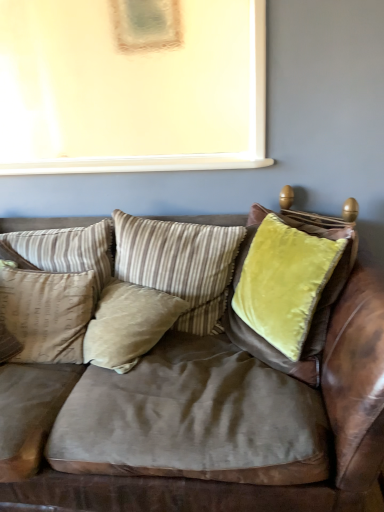
Question: Does beige velvet pillow at center, placed as the second pillow when sorted from right to left, have a greater height compared to beige striped pillow at center, marked as the second pillow in a left-to-right arrangement?

Choices:
 (A) yes
 (B) no

Answer: (B)

Question: From the image's perspective, is beige velvet pillow at center, placed as the second pillow when sorted from right to left, below beige striped pillow at center, marked as the second pillow in a left-to-right arrangement?

Choices:
 (A) no
 (B) yes

Answer: (B)

Question: Is beige velvet pillow at center, acting as the 3th pillow starting from the left, at the right side of beige striped pillow at center, acting as the third pillow starting from the right?

Choices:
 (A) no
 (B) yes

Answer: (B)

Question: Does beige velvet pillow at center, acting as the 3th pillow starting from the left, come in front of beige striped pillow at center, marked as the second pillow in a left-to-right arrangement?

Choices:
 (A) no
 (B) yes

Answer: (B)

Question: Considering the relative positions of beige velvet pillow at center, placed as the second pillow when sorted from right to left, and beige striped pillow at center, acting as the third pillow starting from the right, in the image provided, is beige velvet pillow at center, placed as the second pillow when sorted from right to left, to the left of beige striped pillow at center, acting as the third pillow starting from the right, from the viewer's perspective?

Choices:
 (A) yes
 (B) no

Answer: (B)

Question: In terms of height, does beige fabric pillow at left, acting as the 4th pillow starting from the right, look taller or shorter compared to striped fabric pillow at center, positioned as the 1th pillow in right-to-left order?

Choices:
 (A) tall
 (B) short

Answer: (B)

Question: Visually, is beige fabric pillow at left, arranged as the 1th pillow when viewed from the left, positioned to the left or to the right of striped fabric pillow at center, positioned as the 1th pillow in right-to-left order?

Choices:
 (A) left
 (B) right

Answer: (A)

Question: Based on their sizes in the image, would you say beige fabric pillow at left, acting as the 4th pillow starting from the right, is bigger or smaller than striped fabric pillow at center, positioned as the fourth pillow in left-to-right order?

Choices:
 (A) big
 (B) small

Answer: (B)

Question: From the image's perspective, is beige fabric pillow at left, arranged as the 1th pillow when viewed from the left, above or below striped fabric pillow at center, positioned as the fourth pillow in left-to-right order?

Choices:
 (A) above
 (B) below

Answer: (B)

Question: From a real-world perspective, relative to beige striped pillow at center, marked as the second pillow in a left-to-right arrangement, is velvet brown couch at center vertically above or below?

Choices:
 (A) below
 (B) above

Answer: (A)

Question: Is point (82, 505) closer or farther from the camera than point (51, 252)?

Choices:
 (A) closer
 (B) farther

Answer: (A)

Question: Looking at their shapes, would you say velvet brown couch at center is wider or thinner than beige striped pillow at center, marked as the second pillow in a left-to-right arrangement?

Choices:
 (A) thin
 (B) wide

Answer: (B)

Question: Is velvet brown couch at center in front of or behind beige striped pillow at center, acting as the third pillow starting from the right, in the image?

Choices:
 (A) behind
 (B) front

Answer: (B)

Question: From a real-world perspective, is beige velvet pillow at center, placed as the second pillow when sorted from right to left, physically located above or below beige fabric pillow at left, arranged as the 1th pillow when viewed from the left?

Choices:
 (A) above
 (B) below

Answer: (B)

Question: Looking at the image, does beige velvet pillow at center, acting as the 3th pillow starting from the left, seem bigger or smaller compared to beige fabric pillow at left, acting as the 4th pillow starting from the right?

Choices:
 (A) small
 (B) big

Answer: (A)